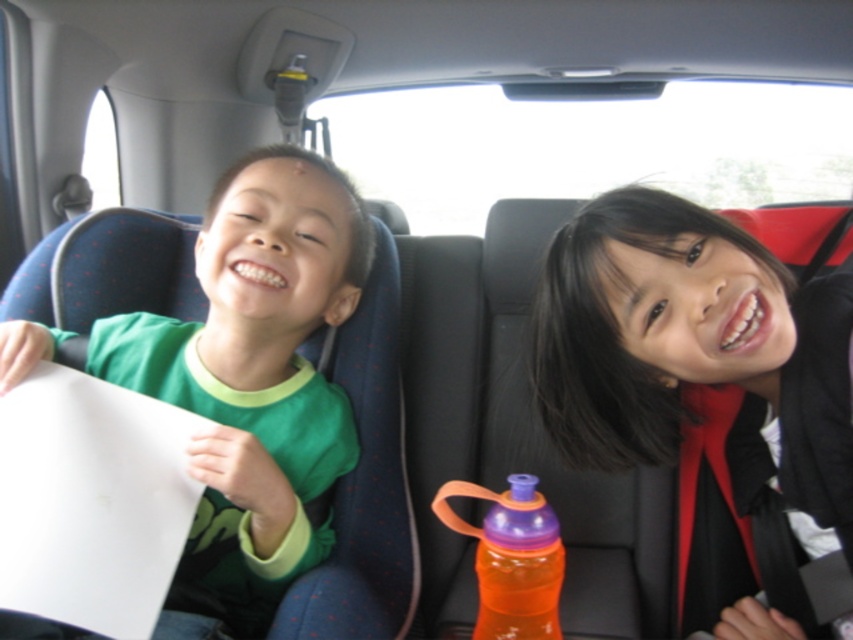
Question: Can you confirm if black fabric hair at upper right is positioned above orange plastic water bottle at center?

Choices:
 (A) yes
 (B) no

Answer: (A)

Question: Does black fabric hair at upper right come behind green matte shirt at left?

Choices:
 (A) no
 (B) yes

Answer: (A)

Question: Which point is farther from the camera taking this photo?

Choices:
 (A) (608, 332)
 (B) (496, 628)
 (C) (321, 518)

Answer: (C)

Question: Which of the following is the farthest from the observer?

Choices:
 (A) orange plastic water bottle at center
 (B) black fabric hair at upper right
 (C) green matte shirt at left

Answer: (C)

Question: Which point is closer to the camera?

Choices:
 (A) orange plastic water bottle at center
 (B) green matte shirt at left
 (C) black fabric hair at upper right

Answer: (A)

Question: Can you confirm if green matte shirt at left is thinner than orange plastic water bottle at center?

Choices:
 (A) no
 (B) yes

Answer: (A)